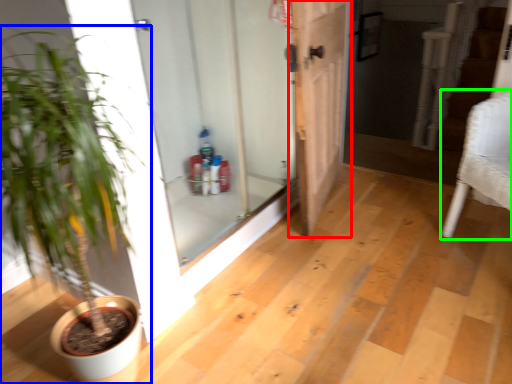
Question: Which is farther away from door (highlighted by a red box)? houseplant (highlighted by a blue box) or armchair (highlighted by a green box)?

Choices:
 (A) houseplant
 (B) armchair

Answer: (A)